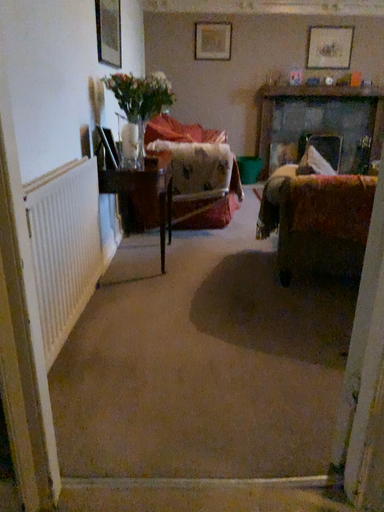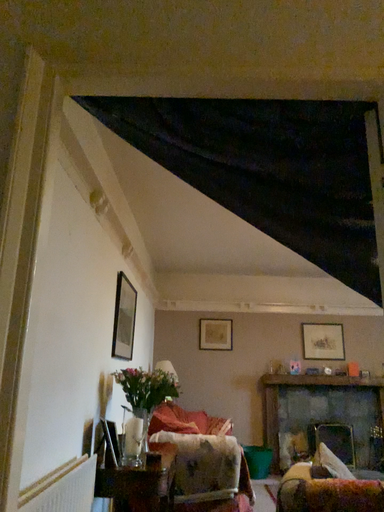
Question: Which way did the camera rotate in the video?

Choices:
 (A) rotated downward
 (B) rotated upward

Answer: (B)